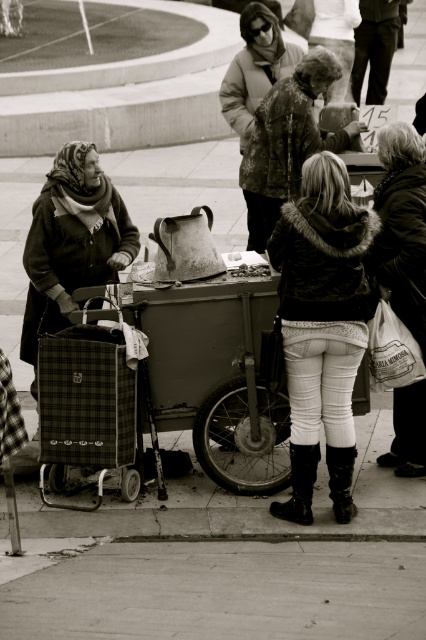
Can you confirm if white textured pants at center is positioned above white textured bag at right?

No, white textured pants at center is not above white textured bag at right.

Is white textured pants at center behind white textured bag at right?

No, it is in front of white textured bag at right.

Between point (345, 227) and point (411, 145), which one is positioned behind?

The point (411, 145) is more distant.

At what (x,y) coordinates should I click in order to perform the action: click on white textured pants at center. Please return your answer as a coordinate pair (x, y). The width and height of the screenshot is (426, 640). Looking at the image, I should click on (322, 326).

Looking at this image, between plaid fabric cart at center and white textured bag at right, which one is positioned lower?

Positioned lower is plaid fabric cart at center.

This screenshot has width=426, height=640. What do you see at coordinates (213, 372) in the screenshot?
I see `plaid fabric cart at center` at bounding box center [213, 372].

Who is more distant from viewer, (195, 406) or (419, 296)?

The point (195, 406) is behind.

Identify the location of plaid fabric cart at center. The width and height of the screenshot is (426, 640). (213, 372).

Who is higher up, white textured pants at center or plaid fabric cart at center?

white textured pants at center is above.

Consider the image. Which is below, white textured pants at center or plaid fabric cart at center?

Positioned lower is plaid fabric cart at center.

Where is `white textured pants at center`? white textured pants at center is located at coordinates (322, 326).